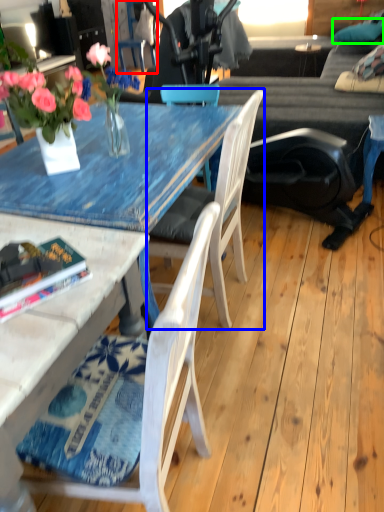
Question: Which object is positioned closest to chair (highlighted by a red box)? Select from chair (highlighted by a blue box) and pillow (highlighted by a green box).

Choices:
 (A) chair
 (B) pillow

Answer: (A)